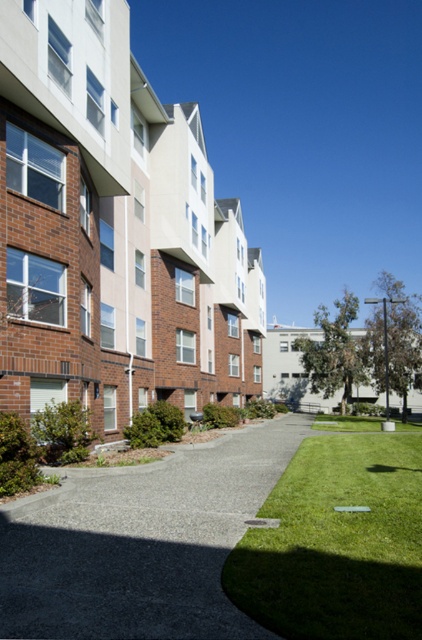
Question: Can you confirm if gray concrete path at center is positioned below green grass at center?

Choices:
 (A) yes
 (B) no

Answer: (A)

Question: Can you confirm if gray concrete path at center is smaller than green grass at center?

Choices:
 (A) no
 (B) yes

Answer: (B)

Question: Is gray concrete path at center to the left of green grass at center from the viewer's perspective?

Choices:
 (A) yes
 (B) no

Answer: (A)